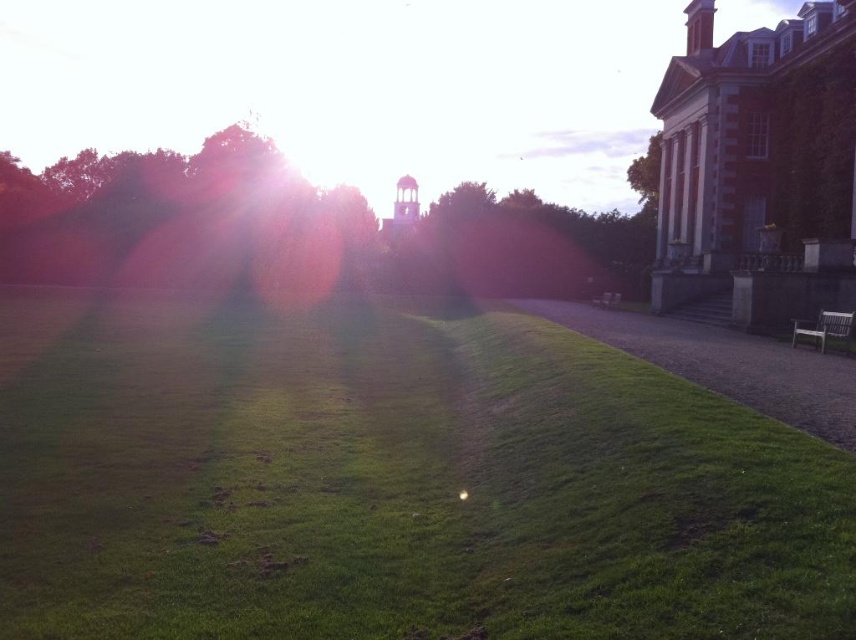
Is white wooden bench at right bigger than metallic silver bench at center?

Incorrect, white wooden bench at right is not larger than metallic silver bench at center.

In the scene shown: Is white wooden bench at right thinner than metallic silver bench at center?

Indeed, white wooden bench at right has a lesser width compared to metallic silver bench at center.

What are the coordinates of `white wooden bench at right` in the screenshot? It's located at click(x=824, y=326).

Who is lower down, green grassy at center or white wooden bench at right?

green grassy at center is below.

Does green grassy at center have a lesser height compared to white wooden bench at right?

No.

Identify the location of green grassy at center. (393, 484).

Who is more distant from viewer, (360, 310) or (613, 291)?

Point (613, 291)

Which is in front, point (831, 547) or point (608, 301)?

Positioned in front is point (831, 547).

This screenshot has height=640, width=856. Find the location of `green grassy at center`. green grassy at center is located at coordinates (393, 484).